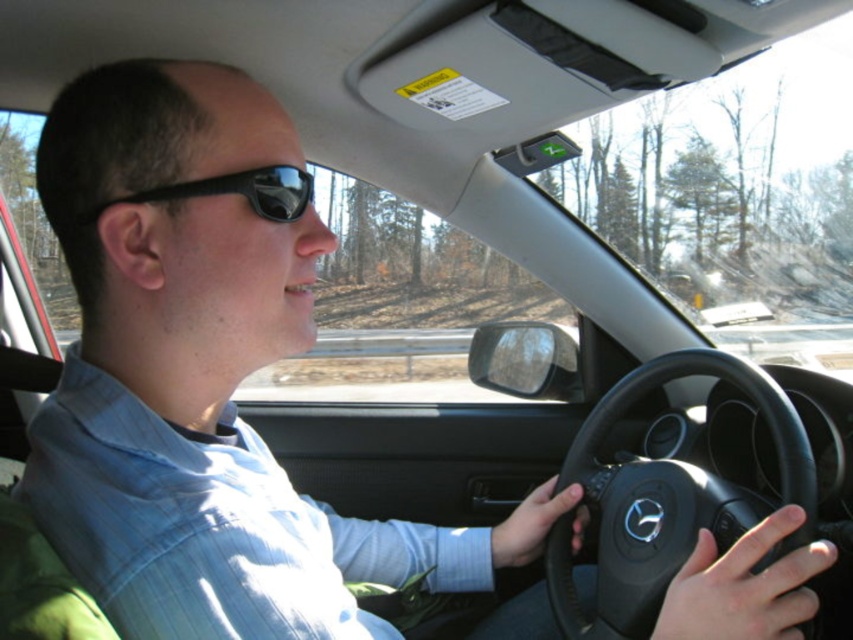
Question: Which point appears closest to the camera in this image?

Choices:
 (A) (192, 192)
 (B) (647, 385)

Answer: (A)

Question: In this image, where is black leather steering wheel at center located relative to black matte sunglasses at upper center?

Choices:
 (A) below
 (B) above

Answer: (A)

Question: Is black leather steering wheel at center to the right of black matte sunglasses at upper center from the viewer's perspective?

Choices:
 (A) yes
 (B) no

Answer: (A)

Question: Does black leather steering wheel at center have a greater width compared to black matte sunglasses at upper center?

Choices:
 (A) no
 (B) yes

Answer: (B)

Question: Among these objects, which one is nearest to the camera?

Choices:
 (A) black matte sunglasses at upper center
 (B) black leather steering wheel at center

Answer: (A)

Question: Which of the following is the closest to the observer?

Choices:
 (A) (695, 525)
 (B) (239, 182)

Answer: (B)